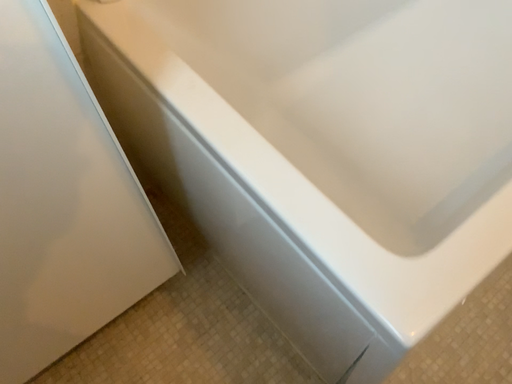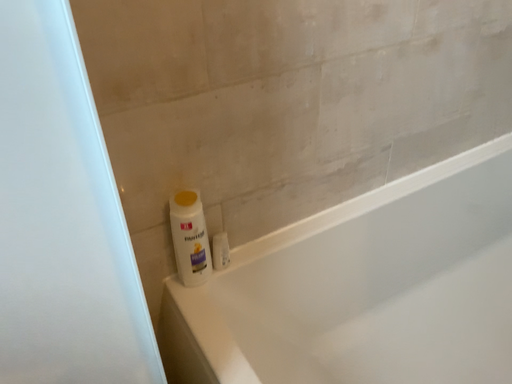
Question: Which way did the camera rotate in the video?

Choices:
 (A) rotated upward
 (B) rotated downward

Answer: (A)